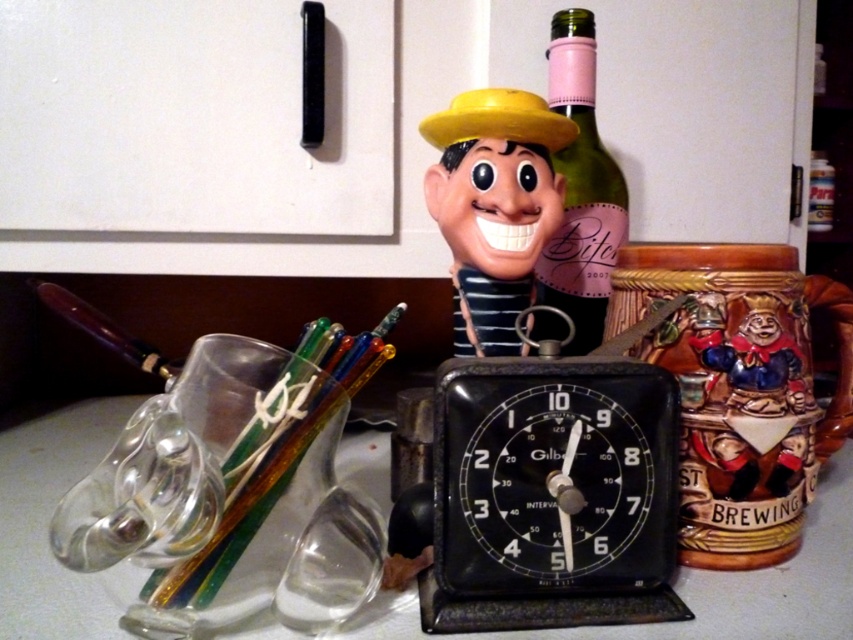
In the scene shown: You are standing in front of the kitchen countertop scene. There are two points marked as point 1 at coordinates (505, 515) and point 2 at (619, 227). Which point is closer to you?

Point 1 at coordinates (505, 515) is closer to you because it is in front of point 2 at (619, 227).

You are organizing a desk and need to place the black plastic clock at center and the green glass bottle at center. If the desk has limited space, which item should you prioritize placing first to ensure both fit?

The black plastic clock at center is smaller than the green glass bottle at center, so you should prioritize placing the green glass bottle at center first to ensure both items fit on the desk.